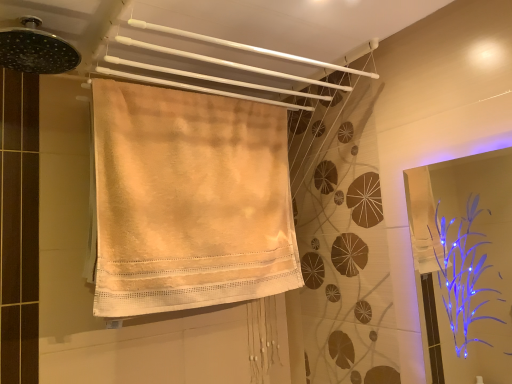
What do you see at coordinates (474, 261) in the screenshot? I see `transparent plastic screen door at right` at bounding box center [474, 261].

Locate an element on the screen. black metallic shower head at upper left is located at coordinates (36, 49).

Describe the element at coordinates (189, 200) in the screenshot. I see `beige cotton towel at center, the second towel positioned from the top` at that location.

The height and width of the screenshot is (384, 512). What do you see at coordinates (227, 63) in the screenshot?
I see `beige cotton towel at upper center, positioned as the 1th towel in top-to-bottom order` at bounding box center [227, 63].

Find the location of a particular element. transparent plastic screen door at right is located at coordinates (474, 261).

Based on their sizes in the image, would you say beige cotton towel at center, marked as the 1th towel in a bottom-to-top arrangement, is bigger or smaller than black metallic shower head at upper left?

Clearly, beige cotton towel at center, marked as the 1th towel in a bottom-to-top arrangement, is larger in size than black metallic shower head at upper left.

Is black metallic shower head at upper left a part of beige cotton towel at center, the second towel positioned from the top?

Definitely not — black metallic shower head at upper left is not inside beige cotton towel at center, the second towel positioned from the top.

From the image's perspective, which one is positioned higher, beige cotton towel at center, marked as the 1th towel in a bottom-to-top arrangement, or black metallic shower head at upper left?

black metallic shower head at upper left.

Locate an element on the screen. The width and height of the screenshot is (512, 384). shower lying above the beige cotton towel at center, marked as the 1th towel in a bottom-to-top arrangement (from the image's perspective) is located at coordinates (36, 49).

Considering the relative sizes of beige cotton towel at upper center, which is the second towel in bottom-to-top order, and transparent plastic screen door at right in the image provided, is beige cotton towel at upper center, which is the second towel in bottom-to-top order, thinner than transparent plastic screen door at right?

No, beige cotton towel at upper center, which is the second towel in bottom-to-top order, is not thinner than transparent plastic screen door at right.

Between point (239, 48) and point (487, 233), which one is positioned in front?

Point (239, 48)

Is beige cotton towel at upper center, which is the second towel in bottom-to-top order, to the left or to the right of transparent plastic screen door at right in the image?

beige cotton towel at upper center, which is the second towel in bottom-to-top order, is to the left of transparent plastic screen door at right.

Looking at this image, does beige cotton towel at upper center, positioned as the 1th towel in top-to-bottom order, turn towards transparent plastic screen door at right?

No, beige cotton towel at upper center, positioned as the 1th towel in top-to-bottom order, does not turn towards transparent plastic screen door at right.

Is beige cotton towel at center, marked as the 1th towel in a bottom-to-top arrangement, looking in the opposite direction of transparent plastic screen door at right?

No, beige cotton towel at center, marked as the 1th towel in a bottom-to-top arrangement, is not facing the opposite direction of transparent plastic screen door at right.

Would you say beige cotton towel at center, the second towel positioned from the top, contains transparent plastic screen door at right?

No, transparent plastic screen door at right is not inside beige cotton towel at center, the second towel positioned from the top.

Measure the distance from beige cotton towel at center, the second towel positioned from the top, to transparent plastic screen door at right.

A distance of 1.09 meters exists between beige cotton towel at center, the second towel positioned from the top, and transparent plastic screen door at right.

Considering the relative sizes of beige cotton towel at center, the second towel positioned from the top, and transparent plastic screen door at right in the image provided, is beige cotton towel at center, the second towel positioned from the top, bigger than transparent plastic screen door at right?

Correct, beige cotton towel at center, the second towel positioned from the top, is larger in size than transparent plastic screen door at right.

Considering the relative sizes of beige cotton towel at upper center, which is the second towel in bottom-to-top order, and black metallic shower head at upper left in the image provided, is beige cotton towel at upper center, which is the second towel in bottom-to-top order, bigger than black metallic shower head at upper left?

Indeed, beige cotton towel at upper center, which is the second towel in bottom-to-top order, has a larger size compared to black metallic shower head at upper left.

From the picture: Is beige cotton towel at upper center, positioned as the 1th towel in top-to-bottom order, located outside black metallic shower head at upper left?

Absolutely, beige cotton towel at upper center, positioned as the 1th towel in top-to-bottom order, is external to black metallic shower head at upper left.

Is beige cotton towel at upper center, which is the second towel in bottom-to-top order, with black metallic shower head at upper left?

beige cotton towel at upper center, which is the second towel in bottom-to-top order, and black metallic shower head at upper left are not in contact.

The image size is (512, 384). What are the coordinates of `shower above the beige cotton towel at upper center, positioned as the 1th towel in top-to-bottom order (from the image's perspective)` in the screenshot? It's located at (36, 49).

Is black metallic shower head at upper left far away from beige cotton towel at center, the second towel positioned from the top?

No, black metallic shower head at upper left is not far from beige cotton towel at center, the second towel positioned from the top.

Consider the image. From a real-world perspective, is black metallic shower head at upper left under beige cotton towel at center, the second towel positioned from the top?

No, from a real-world perspective, black metallic shower head at upper left is not beneath beige cotton towel at center, the second towel positioned from the top.

Considering the relative sizes of black metallic shower head at upper left and beige cotton towel at center, marked as the 1th towel in a bottom-to-top arrangement, in the image provided, is black metallic shower head at upper left thinner than beige cotton towel at center, marked as the 1th towel in a bottom-to-top arrangement,?

Incorrect, the width of black metallic shower head at upper left is not less than that of beige cotton towel at center, marked as the 1th towel in a bottom-to-top arrangement.

From a real-world perspective, is transparent plastic screen door at right over beige cotton towel at center, the second towel positioned from the top?

No, from a real-world perspective, transparent plastic screen door at right is not over beige cotton towel at center, the second towel positioned from the top

Considering the positions of objects transparent plastic screen door at right and beige cotton towel at center, the second towel positioned from the top, in the image provided, who is behind, transparent plastic screen door at right or beige cotton towel at center, the second towel positioned from the top,?

beige cotton towel at center, the second towel positioned from the top, is behind.

From the image's perspective, who appears lower, transparent plastic screen door at right or beige cotton towel at center, marked as the 1th towel in a bottom-to-top arrangement?

transparent plastic screen door at right is shown below in the image.

Looking at this image, is transparent plastic screen door at right bigger than beige cotton towel at center, marked as the 1th towel in a bottom-to-top arrangement?

Actually, transparent plastic screen door at right might be smaller than beige cotton towel at center, marked as the 1th towel in a bottom-to-top arrangement.

Which is behind, point (504, 302) or point (54, 42)?

Point (504, 302)

Which is more to the left, transparent plastic screen door at right or black metallic shower head at upper left?

From the viewer's perspective, black metallic shower head at upper left appears more on the left side.

Is transparent plastic screen door at right turned away from black metallic shower head at upper left?

No, transparent plastic screen door at right is not facing the opposite direction of black metallic shower head at upper left.

Is transparent plastic screen door at right far away from black metallic shower head at upper left?

Indeed, transparent plastic screen door at right is not near black metallic shower head at upper left.

From a real-world perspective, starting from the black metallic shower head at upper left, which towel is the 2nd one below it? Please provide its 2D coordinates.

[(189, 200)]

The width and height of the screenshot is (512, 384). I want to click on the 2nd towel above the transparent plastic screen door at right (from the image's perspective), so click(227, 63).

Estimate the real-world distances between objects in this image. Which object is further from transparent plastic screen door at right, beige cotton towel at upper center, which is the second towel in bottom-to-top order, or beige cotton towel at center, the second towel positioned from the top?

beige cotton towel at upper center, which is the second towel in bottom-to-top order, is positioned further to the anchor transparent plastic screen door at right.

When comparing their distances from transparent plastic screen door at right, does black metallic shower head at upper left or beige cotton towel at upper center, which is the second towel in bottom-to-top order, seem further?

black metallic shower head at upper left is further to transparent plastic screen door at right.

Consider the image. Estimate the real-world distances between objects in this image. Which object is further from transparent plastic screen door at right, beige cotton towel at center, marked as the 1th towel in a bottom-to-top arrangement, or black metallic shower head at upper left?

Based on the image, black metallic shower head at upper left appears to be further to transparent plastic screen door at right.

When comparing their distances from black metallic shower head at upper left, does transparent plastic screen door at right or beige cotton towel at center, the second towel positioned from the top, seem further?

Based on the image, transparent plastic screen door at right appears to be further to black metallic shower head at upper left.

Estimate the real-world distances between objects in this image. Which object is closer to black metallic shower head at upper left, transparent plastic screen door at right or beige cotton towel at upper center, positioned as the 1th towel in top-to-bottom order?

beige cotton towel at upper center, positioned as the 1th towel in top-to-bottom order.

Which object lies further to the anchor point beige cotton towel at center, the second towel positioned from the top, beige cotton towel at upper center, positioned as the 1th towel in top-to-bottom order, or transparent plastic screen door at right?

transparent plastic screen door at right lies further to beige cotton towel at center, the second towel positioned from the top, than the other object.

Which object lies further to the anchor point black metallic shower head at upper left, beige cotton towel at upper center, positioned as the 1th towel in top-to-bottom order, or transparent plastic screen door at right?

transparent plastic screen door at right is further to black metallic shower head at upper left.

When comparing their distances from black metallic shower head at upper left, does beige cotton towel at upper center, positioned as the 1th towel in top-to-bottom order, or beige cotton towel at center, the second towel positioned from the top, seem closer?

beige cotton towel at upper center, positioned as the 1th towel in top-to-bottom order, lies closer to black metallic shower head at upper left than the other object.

The height and width of the screenshot is (384, 512). I want to click on towel between black metallic shower head at upper left and beige cotton towel at upper center, positioned as the 1th towel in top-to-bottom order, so click(189, 200).

Locate an element on the screen. Image resolution: width=512 pixels, height=384 pixels. towel between beige cotton towel at center, the second towel positioned from the top, and transparent plastic screen door at right, in the horizontal direction is located at coordinates (227, 63).